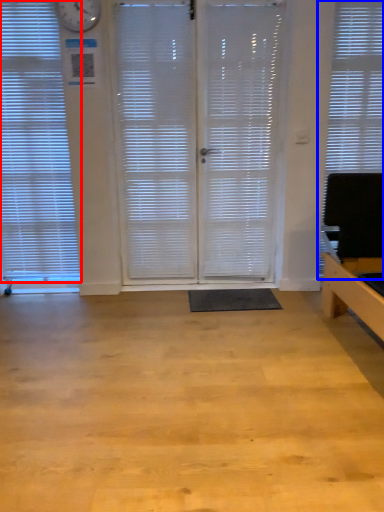
Question: Which of the following is the farthest to the observer, window blind (highlighted by a red box) or window blind (highlighted by a blue box)?

Choices:
 (A) window blind
 (B) window blind

Answer: (B)